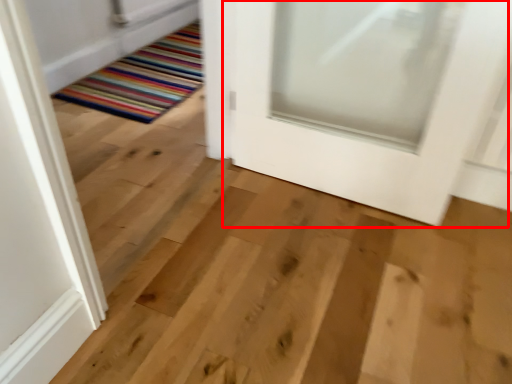
Question: From the image, what is the correct spatial relationship of door (annotated by the red box) in relation to mat?

Choices:
 (A) right
 (B) left

Answer: (A)